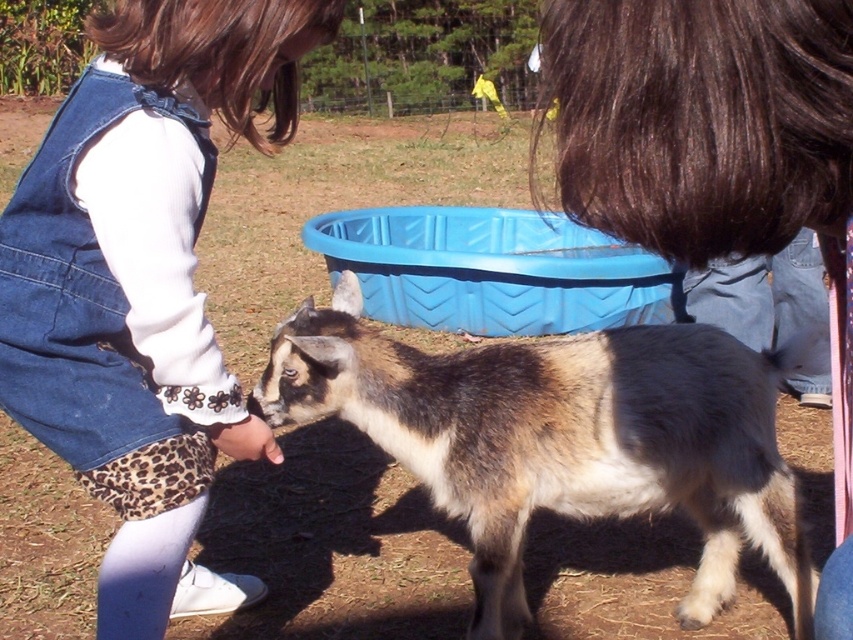
You are a photographer trying to capture a photo of the child and the goat. You want to ensure both the denim overalls at center and the brown and white fur goat at center are clearly visible in the frame. Based on their positions, which object should you position slightly to the right to include both in the photo?

The denim overalls at center is to the left of the brown and white fur goat at center, so you should position the denim overalls at center slightly to the right to include both in the photo.

Where is the denim overalls at center positioned in the image?

The denim overalls at center is located at point coordinates of 0.444 along the x axis and 0.169 along the y axis.

You are a photographer trying to capture a closeup of the brown and white fur goat at center and the dark brown hair at upper center. Which object should you focus on first if you want to ensure both are in focus without moving the camera?

The dark brown hair at upper center is closer to the camera than the brown and white fur goat at center. To keep both in focus, you should focus on the dark brown hair at upper center first since it is closer, allowing the goat to stay sharp in the depth of field.